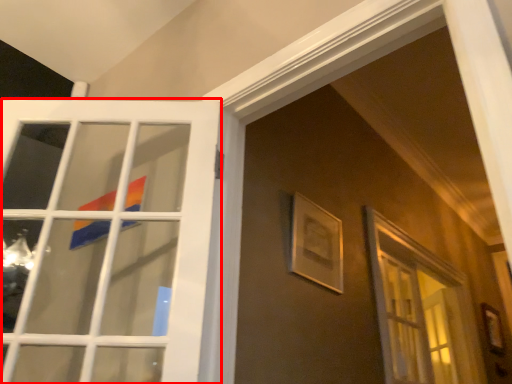
Question: From the image's perspective, what is the correct spatial positioning of door (annotated by the red box) in reference to picture frame?

Choices:
 (A) below
 (B) above

Answer: (B)